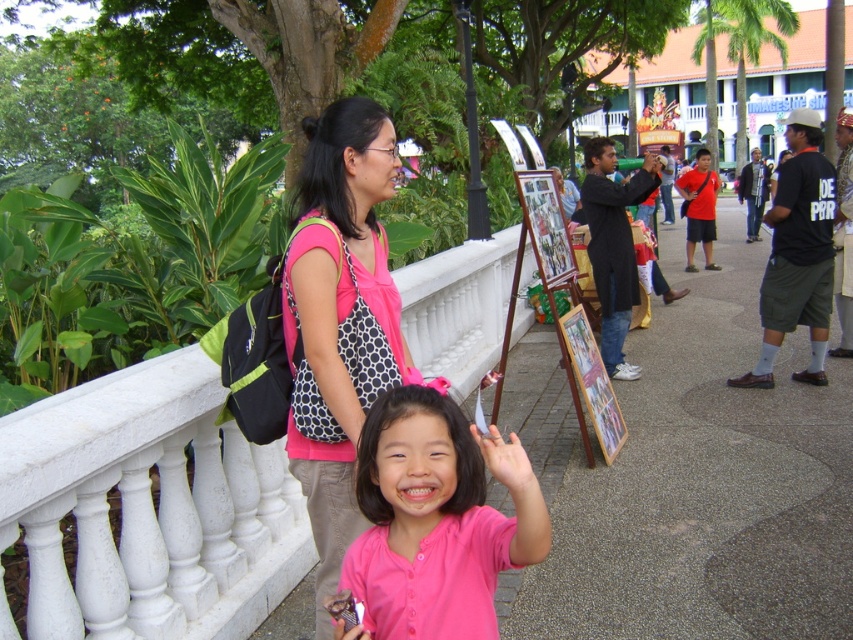
Question: Which object is farther from the camera taking this photo?

Choices:
 (A) pink fabric bag at center
 (B) pink matte shirt at center

Answer: (A)

Question: Considering the relative positions of pink fabric bag at center and pink matte shirt at center in the image provided, where is pink fabric bag at center located with respect to pink matte shirt at center?

Choices:
 (A) right
 (B) left

Answer: (B)

Question: From the image, what is the correct spatial relationship of pink fabric bag at center in relation to pink matte shirt at center?

Choices:
 (A) right
 (B) left

Answer: (B)

Question: Which of the following is the closest to the observer?

Choices:
 (A) pink fabric bag at center
 (B) pink matte shirt at center

Answer: (B)

Question: Is pink fabric bag at center bigger than pink matte shirt at center?

Choices:
 (A) no
 (B) yes

Answer: (B)